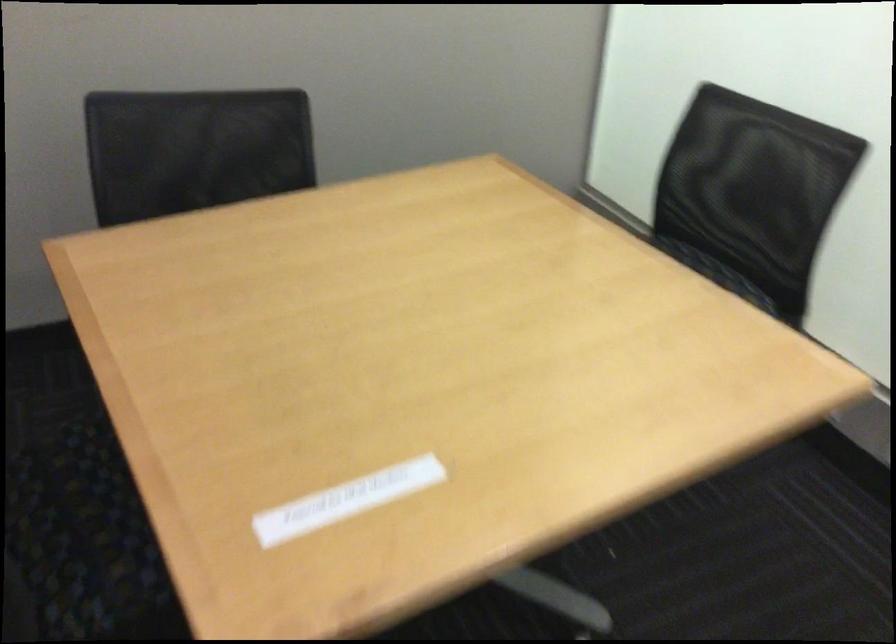
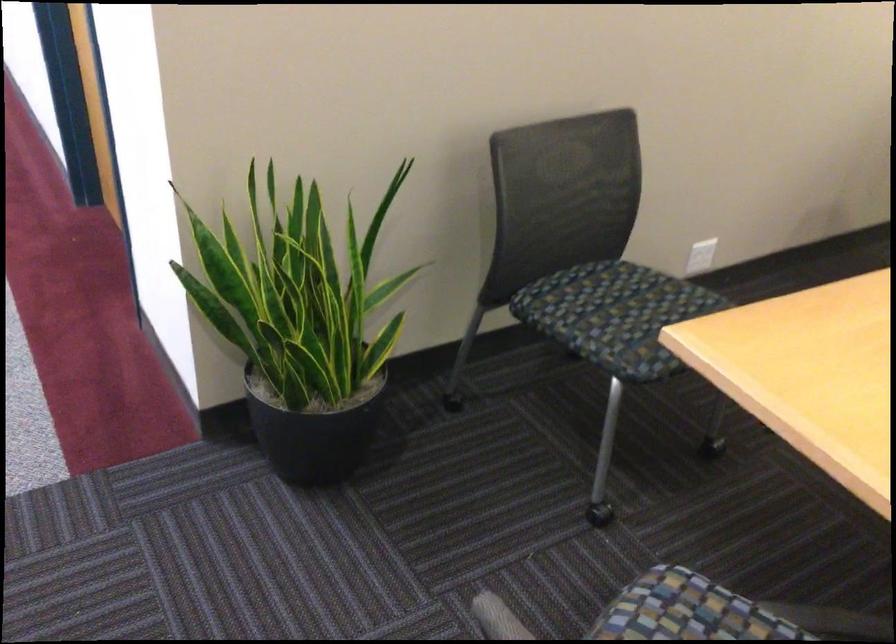
Question: In a continuous first-person perspective shot, in which direction is the camera moving?

Choices:
 (A) Left
 (B) Right
 (C) Forward
 (D) Backward

Answer: (A)